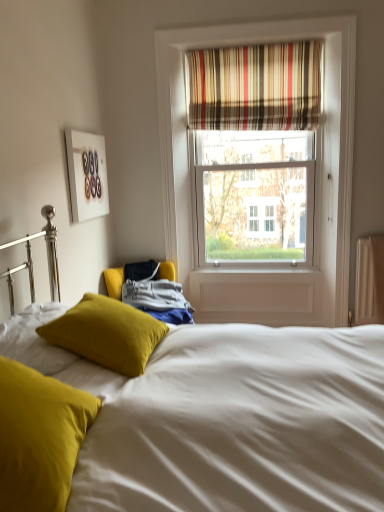
Question: Considering the relative positions of velvet mustard pillow at center, positioned as the 1th pillow in back-to-front order, and matte yellow pillow at lower left, the first pillow when ordered from front to back, in the image provided, is velvet mustard pillow at center, positioned as the 1th pillow in back-to-front order, to the left of matte yellow pillow at lower left, the first pillow when ordered from front to back, from the viewer's perspective?

Choices:
 (A) no
 (B) yes

Answer: (A)

Question: Can you confirm if velvet mustard pillow at center, positioned as the 1th pillow in back-to-front order, is taller than matte yellow pillow at lower left, the 2th pillow in the back-to-front sequence?

Choices:
 (A) yes
 (B) no

Answer: (B)

Question: From a real-world perspective, is velvet mustard pillow at center, which is the 2th pillow from front to back, located beneath matte yellow pillow at lower left, the 2th pillow in the back-to-front sequence?

Choices:
 (A) yes
 (B) no

Answer: (A)

Question: Does velvet mustard pillow at center, positioned as the 1th pillow in back-to-front order, lie in front of matte yellow pillow at lower left, the first pillow when ordered from front to back?

Choices:
 (A) no
 (B) yes

Answer: (A)

Question: Are velvet mustard pillow at center, positioned as the 1th pillow in back-to-front order, and matte yellow pillow at lower left, the first pillow when ordered from front to back, making contact?

Choices:
 (A) yes
 (B) no

Answer: (B)

Question: Does velvet mustard pillow at center, positioned as the 1th pillow in back-to-front order, have a lesser height compared to matte yellow pillow at lower left, the 2th pillow in the back-to-front sequence?

Choices:
 (A) yes
 (B) no

Answer: (A)

Question: Is matte yellow pillow at lower left, the 2th pillow in the back-to-front sequence, not within velvet mustard pillow at center, positioned as the 1th pillow in back-to-front order?

Choices:
 (A) no
 (B) yes

Answer: (B)

Question: Does matte yellow pillow at lower left, the first pillow when ordered from front to back, turn towards velvet mustard pillow at center, positioned as the 1th pillow in back-to-front order?

Choices:
 (A) yes
 (B) no

Answer: (B)

Question: Is the depth of matte yellow pillow at lower left, the first pillow when ordered from front to back, greater than that of velvet mustard pillow at center, which is the 2th pillow from front to back?

Choices:
 (A) yes
 (B) no

Answer: (B)

Question: Can you confirm if matte yellow pillow at lower left, the 2th pillow in the back-to-front sequence, is thinner than velvet mustard pillow at center, positioned as the 1th pillow in back-to-front order?

Choices:
 (A) no
 (B) yes

Answer: (B)

Question: Is matte yellow pillow at lower left, the 2th pillow in the back-to-front sequence, facing away from velvet mustard pillow at center, positioned as the 1th pillow in back-to-front order?

Choices:
 (A) yes
 (B) no

Answer: (B)

Question: Is matte yellow pillow at lower left, the 2th pillow in the back-to-front sequence, surrounding velvet mustard pillow at center, positioned as the 1th pillow in back-to-front order?

Choices:
 (A) yes
 (B) no

Answer: (B)

Question: Is velvet mustard pillow at center, positioned as the 1th pillow in back-to-front order, thinner than striped fabric curtain at upper center?

Choices:
 (A) no
 (B) yes

Answer: (A)